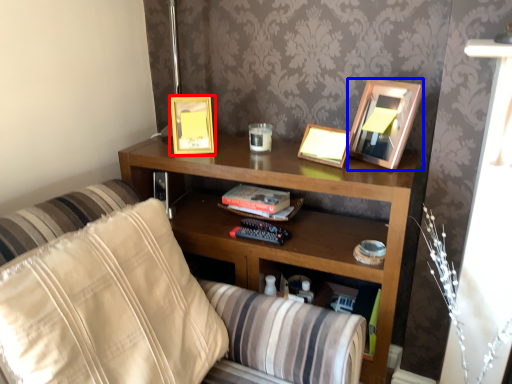
Question: Which of the following is the farthest to the observer, picture frame (highlighted by a red box) or picture frame (highlighted by a blue box)?

Choices:
 (A) picture frame
 (B) picture frame

Answer: (A)